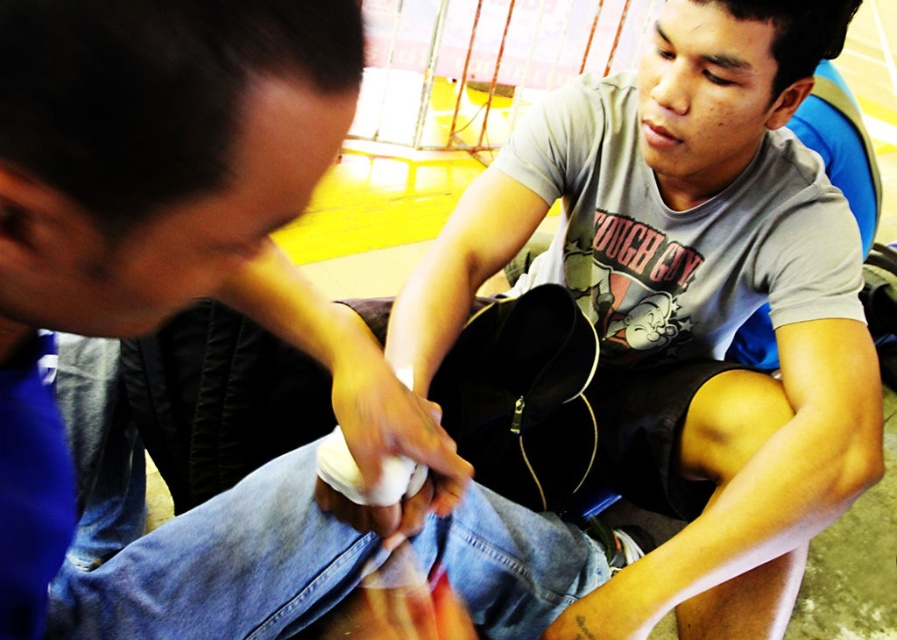
Question: Among these objects, which one is nearest to the camera?

Choices:
 (A) matte gray t-shirt at center
 (B) gray matte t-shirt at upper center

Answer: (B)

Question: Can you confirm if gray matte t-shirt at upper center is thinner than matte gray t-shirt at center?

Choices:
 (A) yes
 (B) no

Answer: (A)

Question: Does gray matte t-shirt at upper center appear on the left side of matte gray t-shirt at center?

Choices:
 (A) no
 (B) yes

Answer: (B)

Question: Is gray matte t-shirt at upper center above matte gray t-shirt at center?

Choices:
 (A) yes
 (B) no

Answer: (B)